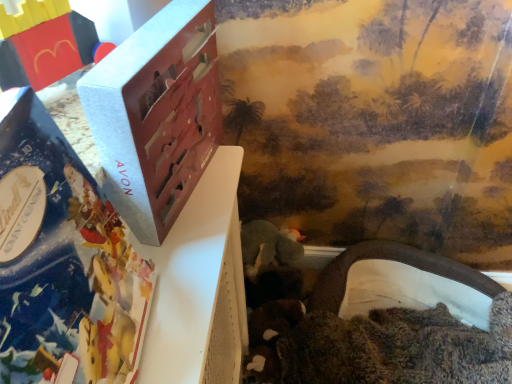
The height and width of the screenshot is (384, 512). What do you see at coordinates (42, 44) in the screenshot?
I see `brick-like plastic toy at upper left, placed as the 1th toy when sorted from front to back` at bounding box center [42, 44].

The height and width of the screenshot is (384, 512). What do you see at coordinates (156, 115) in the screenshot?
I see `matte gray box at center` at bounding box center [156, 115].

The height and width of the screenshot is (384, 512). In order to click on white fabric tunnel at lower right, which is the first toy in right-to-left order in this screenshot , I will do `click(388, 324)`.

Identify the location of brick-like plastic toy at upper left, positioned as the 2th toy in back-to-front order. (42, 44).

Is matte gray box at center wider or thinner than brick-like plastic toy at upper left, which is the 2th toy in right-to-left order?

Clearly, matte gray box at center has less width compared to brick-like plastic toy at upper left, which is the 2th toy in right-to-left order.

Which is behind, point (86, 94) or point (26, 40)?

The point (26, 40) is more distant.

Considering their positions, is matte gray box at center located in front of or behind brick-like plastic toy at upper left, placed as the 1th toy when sorted from front to back?

In the image, matte gray box at center appears in front of brick-like plastic toy at upper left, placed as the 1th toy when sorted from front to back.

Based on the photo, between matte gray box at center and brick-like plastic toy at upper left, which appears as the first toy when viewed from the top, which one appears on the left side from the viewer's perspective?

Positioned to the left is brick-like plastic toy at upper left, which appears as the first toy when viewed from the top.

Locate an element on the screen. box that is under the matte silver book at left (from a real-world perspective) is located at coordinates (156, 115).

Considering the relative sizes of matte gray box at center and matte silver book at left in the image provided, is matte gray box at center taller than matte silver book at left?

In fact, matte gray box at center may be shorter than matte silver book at left.

From the picture: Which point is more forward, (188,14) or (37,125)?

Positioned in front is point (37,125).

Considering the positions of objects matte gray box at center and matte silver book at left in the image provided, who is behind, matte gray box at center or matte silver book at left?

Positioned behind is matte gray box at center.

Can you confirm if white fabric tunnel at lower right, which is the 1th toy from back to front, is taller than brick-like plastic toy at upper left, arranged as the 2th toy when ordered from the bottom?

Yes, white fabric tunnel at lower right, which is the 1th toy from back to front, is taller than brick-like plastic toy at upper left, arranged as the 2th toy when ordered from the bottom.

Can you confirm if white fabric tunnel at lower right, which is the 1th toy from back to front, is positioned to the right of brick-like plastic toy at upper left, which is the 2th toy in right-to-left order?

Yes, white fabric tunnel at lower right, which is the 1th toy from back to front, is to the right of brick-like plastic toy at upper left, which is the 2th toy in right-to-left order.

Consider the image. Between white fabric tunnel at lower right, arranged as the 1th toy when ordered from the bottom, and brick-like plastic toy at upper left, arranged as the 2th toy when ordered from the bottom, which one has smaller width?

With smaller width is brick-like plastic toy at upper left, arranged as the 2th toy when ordered from the bottom.

Could brick-like plastic toy at upper left, arranged as the 2th toy when ordered from the bottom, be considered to be inside white fabric tunnel at lower right, arranged as the 1th toy when ordered from the bottom?

No, brick-like plastic toy at upper left, arranged as the 2th toy when ordered from the bottom, is not a part of white fabric tunnel at lower right, arranged as the 1th toy when ordered from the bottom.

Does white fabric tunnel at lower right, acting as the second toy starting from the front, turn towards matte silver book at left?

No, white fabric tunnel at lower right, acting as the second toy starting from the front, is not turned towards matte silver book at left.

From the image's perspective, relative to matte silver book at left, is white fabric tunnel at lower right, which is the 1th toy from back to front, above or below?

Clearly, from the image's perspective, white fabric tunnel at lower right, which is the 1th toy from back to front, is below matte silver book at left.

Is white fabric tunnel at lower right, which is the first toy in right-to-left order, far away from matte silver book at left?

Indeed, white fabric tunnel at lower right, which is the first toy in right-to-left order, is not near matte silver book at left.

What's the angular difference between brick-like plastic toy at upper left, which appears as the first toy when viewed from the top, and white fabric tunnel at lower right, which is the first toy in right-to-left order,'s facing directions?

The facing directions of brick-like plastic toy at upper left, which appears as the first toy when viewed from the top, and white fabric tunnel at lower right, which is the first toy in right-to-left order, are 90.4 degrees apart.

From the image's perspective, is brick-like plastic toy at upper left, which appears as the first toy when viewed from the top, above or below white fabric tunnel at lower right, which is the first toy in right-to-left order?

brick-like plastic toy at upper left, which appears as the first toy when viewed from the top, is situated higher than white fabric tunnel at lower right, which is the first toy in right-to-left order, in the image.

In terms of width, does brick-like plastic toy at upper left, which appears as the first toy when viewed from the top, look wider or thinner when compared to white fabric tunnel at lower right, positioned as the 2th toy in top-to-bottom order?

brick-like plastic toy at upper left, which appears as the first toy when viewed from the top, is thinner than white fabric tunnel at lower right, positioned as the 2th toy in top-to-bottom order.

Considering the sizes of objects brick-like plastic toy at upper left, which appears as the first toy when viewed from the top, and white fabric tunnel at lower right, which is the first toy in right-to-left order, in the image provided, who is smaller, brick-like plastic toy at upper left, which appears as the first toy when viewed from the top, or white fabric tunnel at lower right, which is the first toy in right-to-left order,?

Smaller between the two is brick-like plastic toy at upper left, which appears as the first toy when viewed from the top.

Where is `toy above the matte gray box at center (from a real-world perspective)`? The height and width of the screenshot is (384, 512). toy above the matte gray box at center (from a real-world perspective) is located at coordinates (42, 44).

From a real-world perspective, is brick-like plastic toy at upper left, marked as the 1th toy in a left-to-right arrangement, located beneath matte gray box at center?

No, from a real-world perspective, brick-like plastic toy at upper left, marked as the 1th toy in a left-to-right arrangement, is not beneath matte gray box at center.

Can you tell me how much brick-like plastic toy at upper left, arranged as the 2th toy when ordered from the bottom, and matte gray box at center differ in facing direction?

There is a 10.1-degree angle between the facing directions of brick-like plastic toy at upper left, arranged as the 2th toy when ordered from the bottom, and matte gray box at center.

Is brick-like plastic toy at upper left, which is the 2th toy in right-to-left order, turned away from matte gray box at center?

brick-like plastic toy at upper left, which is the 2th toy in right-to-left order, is not turned away from matte gray box at center.

Considering the relative sizes of brick-like plastic toy at upper left, which is the 2th toy in right-to-left order, and matte silver book at left in the image provided, is brick-like plastic toy at upper left, which is the 2th toy in right-to-left order, bigger than matte silver book at left?

Actually, brick-like plastic toy at upper left, which is the 2th toy in right-to-left order, might be smaller than matte silver book at left.

Is brick-like plastic toy at upper left, placed as the 1th toy when sorted from front to back, situated inside matte silver book at left or outside?

brick-like plastic toy at upper left, placed as the 1th toy when sorted from front to back, exists outside the volume of matte silver book at left.

Based on the photo, from the image's perspective, is brick-like plastic toy at upper left, which is the 2th toy in right-to-left order, on top of matte silver book at left?

Yes.

Image resolution: width=512 pixels, height=384 pixels. What are the coordinates of `book in front of the brick-like plastic toy at upper left, arranged as the 2th toy when ordered from the bottom` in the screenshot? It's located at (63, 261).

In order to click on toy that appears on the left of matte gray box at center in this screenshot , I will do `click(42, 44)`.

I want to click on book in front of the matte gray box at center, so click(63, 261).

From the image, which object appears to be nearer to matte gray box at center, brick-like plastic toy at upper left, placed as the 1th toy when sorted from front to back, or white fabric tunnel at lower right, positioned as the 2th toy in top-to-bottom order?

brick-like plastic toy at upper left, placed as the 1th toy when sorted from front to back, lies closer to matte gray box at center than the other object.

When comparing their distances from matte gray box at center, does white fabric tunnel at lower right, which is the first toy in right-to-left order, or matte silver book at left seem closer?

matte silver book at left is closer to matte gray box at center.

Considering their positions, is white fabric tunnel at lower right, acting as the second toy starting from the front, positioned further to matte silver book at left than brick-like plastic toy at upper left, placed as the 1th toy when sorted from front to back?

white fabric tunnel at lower right, acting as the second toy starting from the front.

Based on their spatial positions, is matte silver book at left or matte gray box at center further from brick-like plastic toy at upper left, which is the 2th toy in right-to-left order?

matte silver book at left is further to brick-like plastic toy at upper left, which is the 2th toy in right-to-left order.

Considering their positions, is matte silver book at left positioned further to matte gray box at center than white fabric tunnel at lower right, arranged as the 1th toy when ordered from the bottom?

white fabric tunnel at lower right, arranged as the 1th toy when ordered from the bottom, is positioned further to the anchor matte gray box at center.

In the scene shown: From the image, which object appears to be nearer to matte silver book at left, brick-like plastic toy at upper left, placed as the 1th toy when sorted from front to back, or matte gray box at center?

Based on the image, matte gray box at center appears to be nearer to matte silver book at left.

From the image, which object appears to be nearer to white fabric tunnel at lower right, arranged as the 1th toy when ordered from the bottom, matte silver book at left or matte gray box at center?

The object closer to white fabric tunnel at lower right, arranged as the 1th toy when ordered from the bottom, is matte gray box at center.

Based on their spatial positions, is matte silver book at left or white fabric tunnel at lower right, arranged as the 1th toy when ordered from the bottom, closer to brick-like plastic toy at upper left, arranged as the 2th toy when ordered from the bottom?

matte silver book at left is positioned closer to the anchor brick-like plastic toy at upper left, arranged as the 2th toy when ordered from the bottom.

This screenshot has height=384, width=512. Identify the location of book situated between brick-like plastic toy at upper left, positioned as the 2th toy in back-to-front order, and white fabric tunnel at lower right, arranged as the 1th toy when ordered from the bottom, from left to right. (63, 261).

Where is `box between matte silver book at left and brick-like plastic toy at upper left, arranged as the 2th toy when ordered from the bottom, along the z-axis`? The width and height of the screenshot is (512, 384). box between matte silver book at left and brick-like plastic toy at upper left, arranged as the 2th toy when ordered from the bottom, along the z-axis is located at coordinates (156, 115).

This screenshot has height=384, width=512. Identify the location of box between brick-like plastic toy at upper left, placed as the 1th toy when sorted from front to back, and white fabric tunnel at lower right, arranged as the 1th toy when ordered from the bottom, from left to right. (156, 115).

Where is `box between matte silver book at left and white fabric tunnel at lower right, which is the first toy in right-to-left order, in the front-back direction`? This screenshot has width=512, height=384. box between matte silver book at left and white fabric tunnel at lower right, which is the first toy in right-to-left order, in the front-back direction is located at coordinates (156, 115).